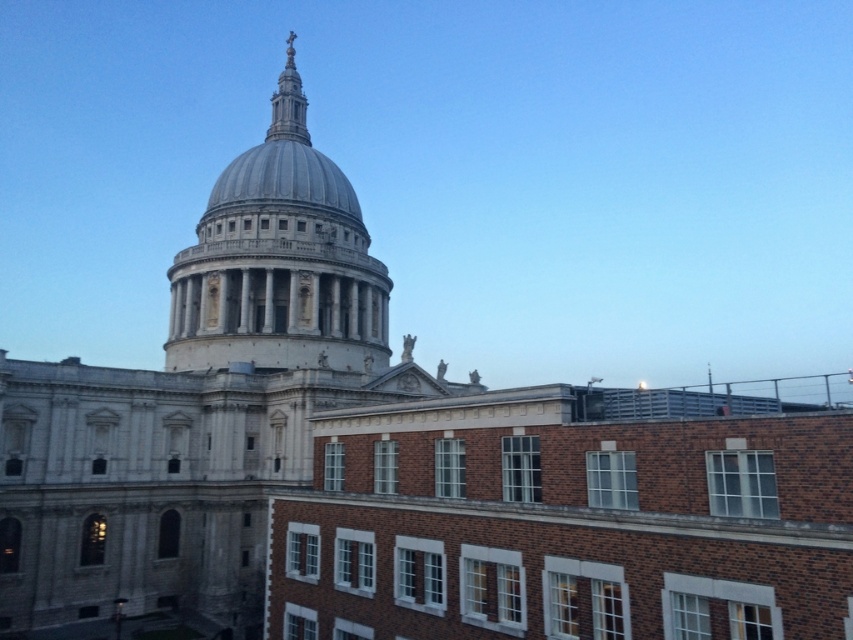
Question: Is white marble dome at center to the right of gold metallic spire at upper center from the viewer's perspective?

Choices:
 (A) no
 (B) yes

Answer: (B)

Question: Is white marble dome at center above gold metallic spire at upper center?

Choices:
 (A) no
 (B) yes

Answer: (A)

Question: Does white marble dome at center appear on the left side of gold metallic spire at upper center?

Choices:
 (A) no
 (B) yes

Answer: (A)

Question: Which point is closer to the camera?

Choices:
 (A) gold metallic spire at upper center
 (B) white marble dome at center

Answer: (B)

Question: Which point appears farthest from the camera in this image?

Choices:
 (A) (349, 192)
 (B) (286, 51)

Answer: (B)